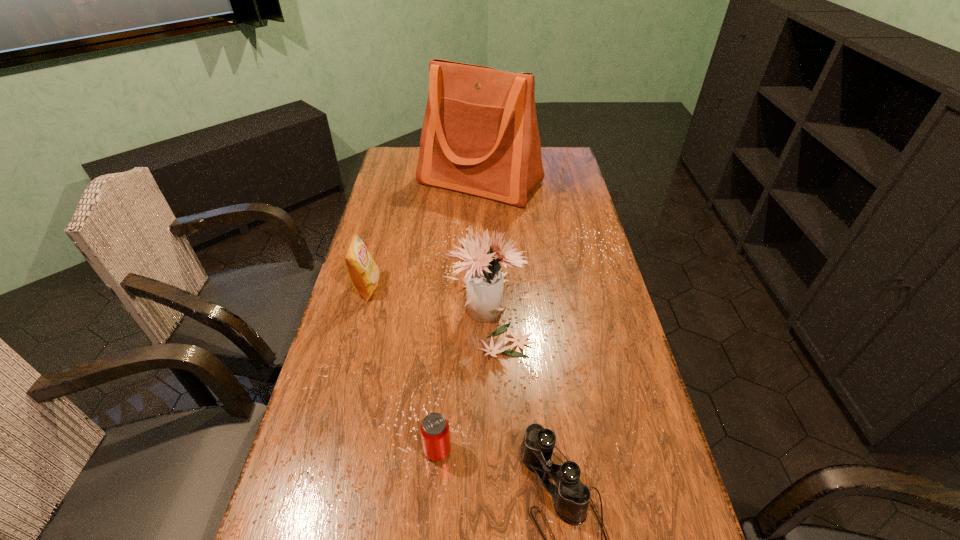
Where is `vacant area that lies between the can and the leftmost object`? vacant area that lies between the can and the leftmost object is located at coordinates (402, 369).

Locate an element on the screen. Image resolution: width=960 pixels, height=540 pixels. unoccupied position between the bouquet and the can is located at coordinates (464, 380).

Find the location of a particular element. Image resolution: width=960 pixels, height=540 pixels. free area in between the tallest object and the can is located at coordinates (459, 316).

Image resolution: width=960 pixels, height=540 pixels. I want to click on the third closest object relative to the binoculars, so click(x=362, y=270).

Image resolution: width=960 pixels, height=540 pixels. What are the coordinates of `object that stands as the fourth closest to the farthest object` in the screenshot? It's located at (571, 497).

Locate an element on the screen. free spot that satisfies the following two spatial constraints: 1. on the front-facing side of the leftmost object; 2. on the right side of the can is located at coordinates (324, 450).

Locate an element on the screen. free space that satisfies the following two spatial constraints: 1. on the front-facing side of the leftmost object; 2. on the right side of the fourth shortest object is located at coordinates (361, 310).